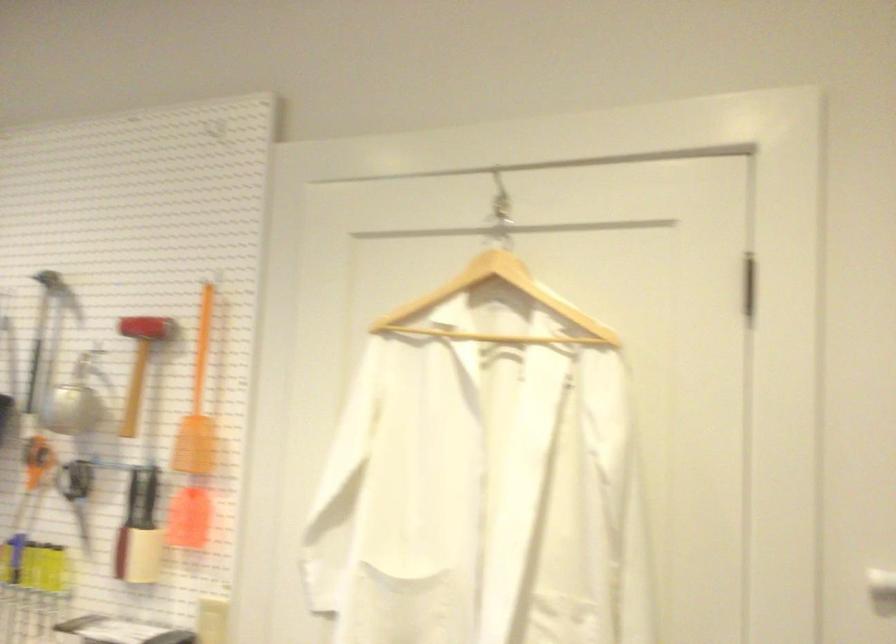
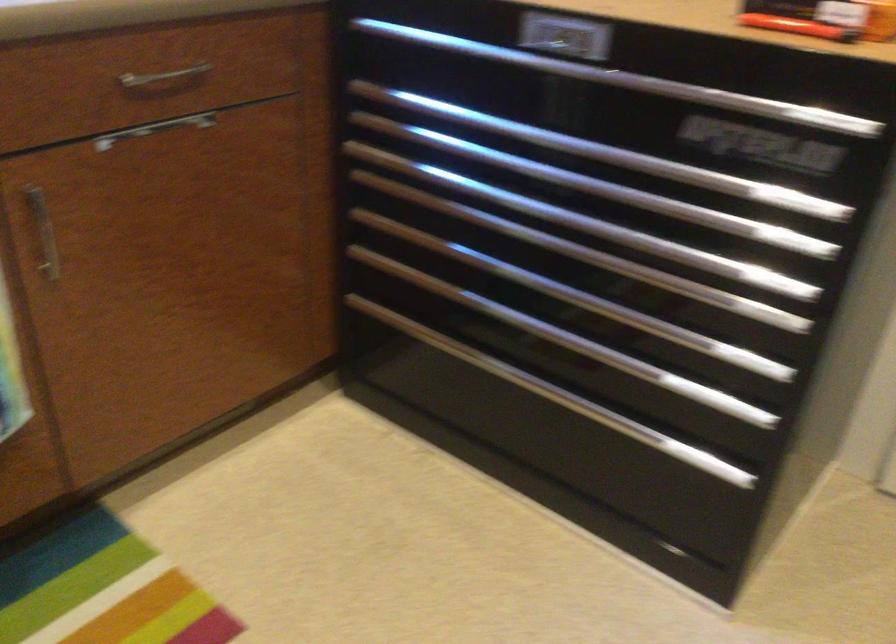
The images are taken continuously from a first-person perspective. In which direction is your viewpoint rotating?

The rotation direction of the camera is left-down.